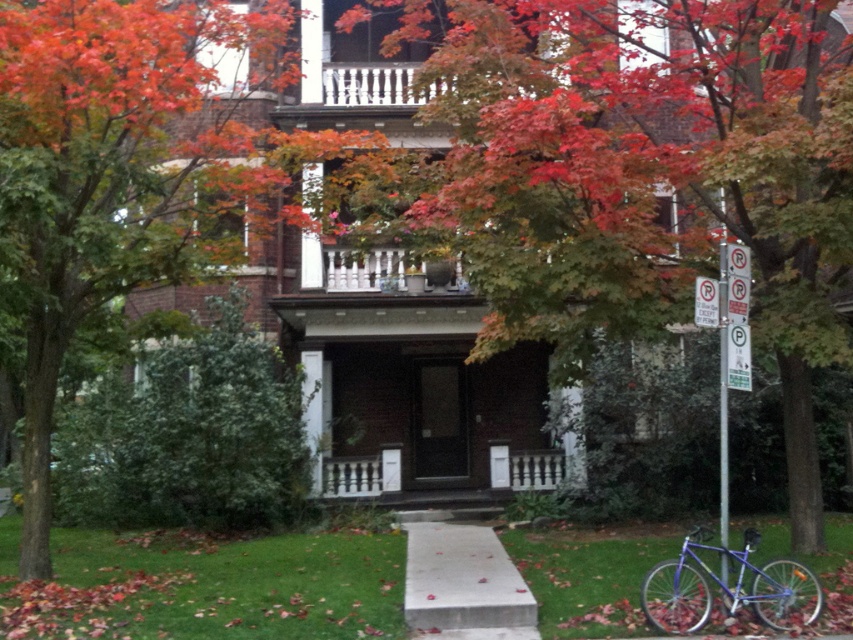
Question: Which point appears closest to the camera in this image?

Choices:
 (A) (514, 472)
 (B) (38, 401)

Answer: (B)

Question: Can you confirm if shiny blue bicycle at lower right is positioned below white wooden porch at center?

Choices:
 (A) no
 (B) yes

Answer: (A)

Question: Among these objects, which one is nearest to the camera?

Choices:
 (A) autumn leaves at center
 (B) white wooden porch at center

Answer: (A)

Question: Which point is farther to the camera?

Choices:
 (A) (813, 604)
 (B) (645, 49)

Answer: (B)

Question: Is the position of shiny blue bicycle at lower right more distant than that of white wooden porch at center?

Choices:
 (A) yes
 (B) no

Answer: (B)

Question: Is shiny blue bicycle at lower right wider than white wooden porch at center?

Choices:
 (A) yes
 (B) no

Answer: (A)